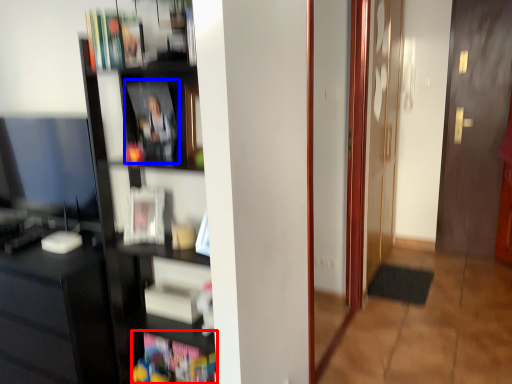
Question: Among these objects, which one is nearest to the camera, book (highlighted by a red box) or book (highlighted by a blue box)?

Choices:
 (A) book
 (B) book

Answer: (B)